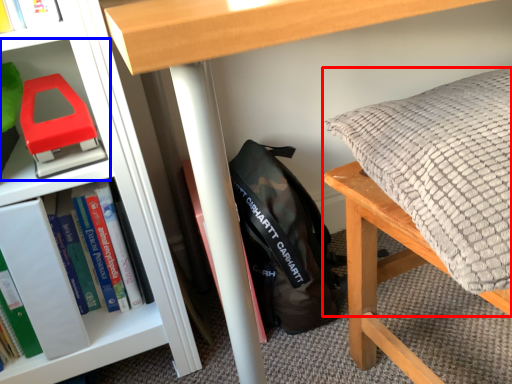
Question: Which point is closer to the camera, pillow (highlighted by a red box) or shelf (highlighted by a blue box)?

Choices:
 (A) pillow
 (B) shelf

Answer: (A)